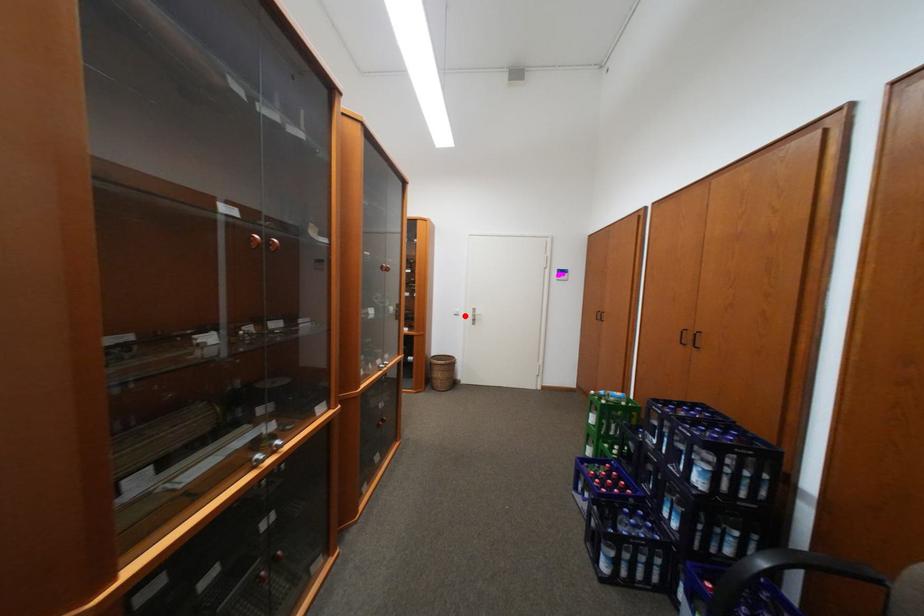
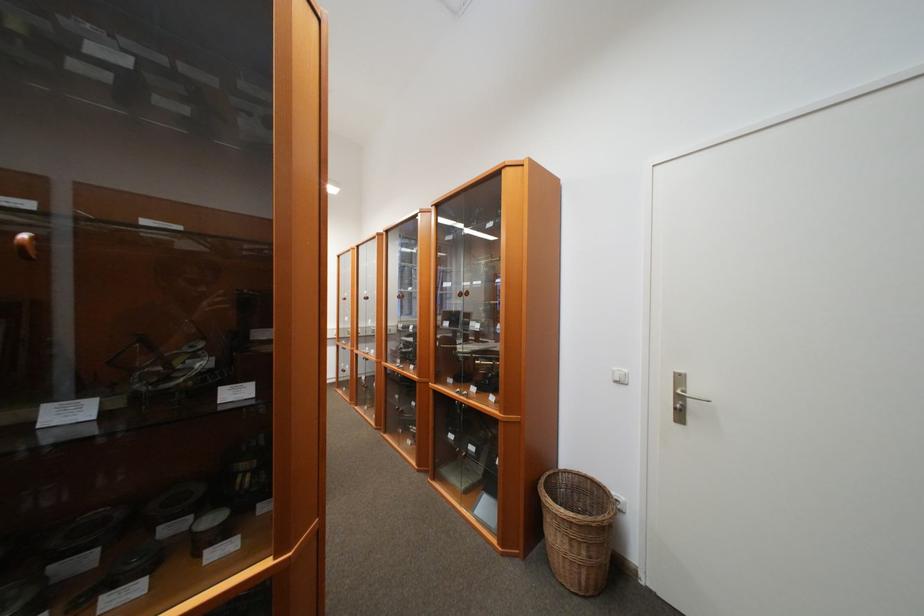
Where in the second image is the point corresponding to the highlighted location from the first image?

(626, 383)